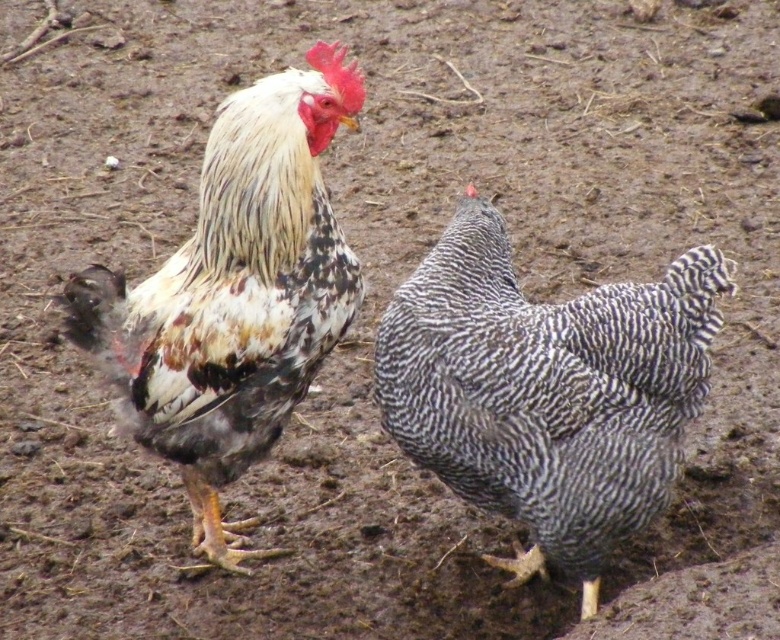
Question: In this image, where is speckled feathered hen at center located relative to speckled feathered rooster at center?

Choices:
 (A) right
 (B) left

Answer: (A)

Question: Is speckled feathered hen at center to the left of speckled feathered rooster at center from the viewer's perspective?

Choices:
 (A) yes
 (B) no

Answer: (B)

Question: Which object is farther from the camera taking this photo?

Choices:
 (A) speckled feathered rooster at center
 (B) speckled feathered hen at center

Answer: (B)

Question: Can you confirm if speckled feathered hen at center is smaller than speckled feathered rooster at center?

Choices:
 (A) no
 (B) yes

Answer: (B)

Question: Which object appears closest to the camera in this image?

Choices:
 (A) speckled feathered hen at center
 (B) speckled feathered rooster at center

Answer: (B)